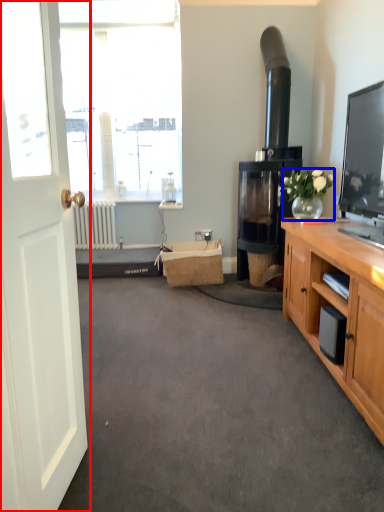
Question: Among these objects, which one is nearest to the camera, door (highlighted by a red box) or houseplant (highlighted by a blue box)?

Choices:
 (A) door
 (B) houseplant

Answer: (A)